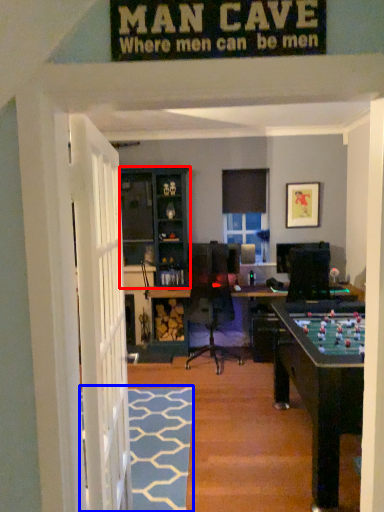
Question: Which point is closer to the camera, cabinetry (highlighted by a red box) or doormat (highlighted by a blue box)?

Choices:
 (A) cabinetry
 (B) doormat

Answer: (B)